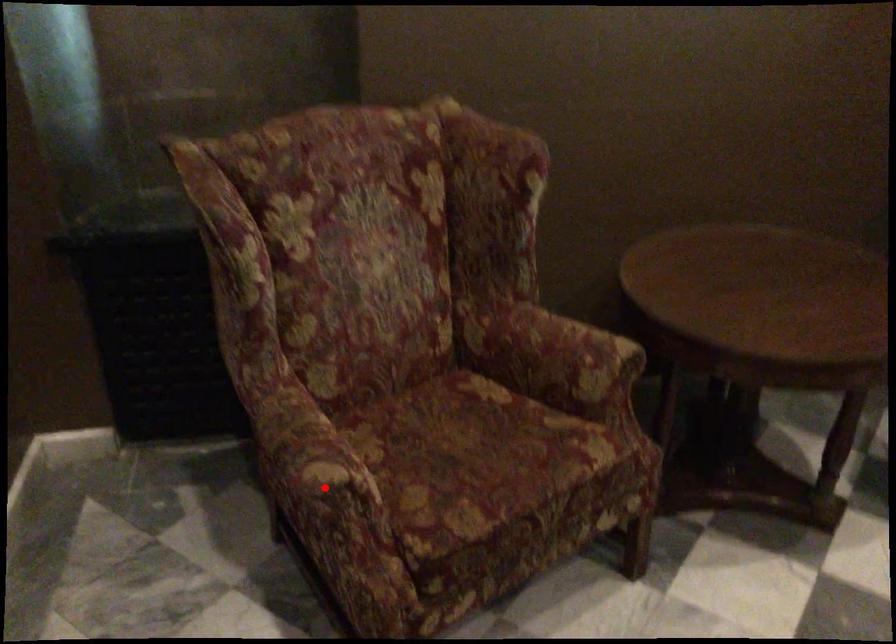
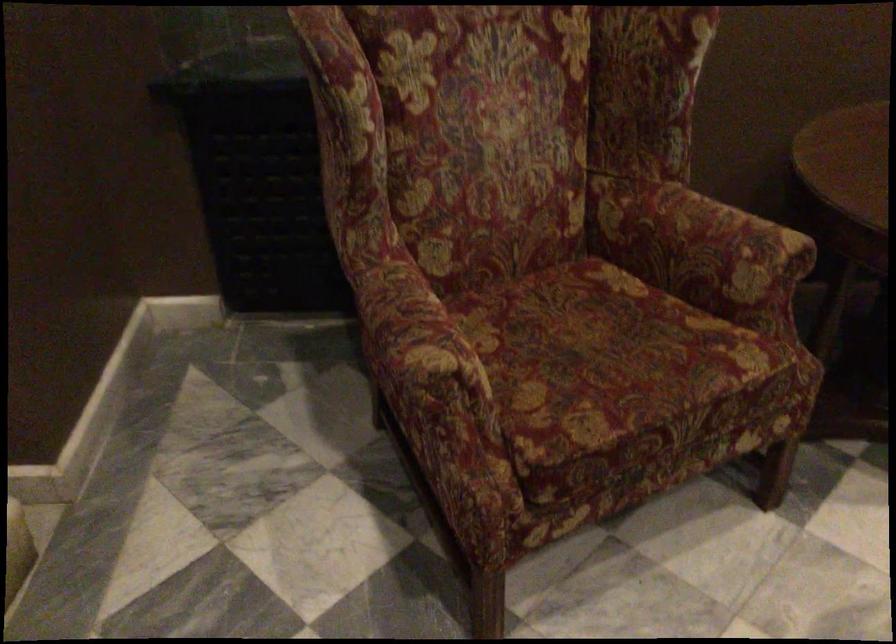
Locate, in the second image, the point that corresponds to the highlighted location in the first image.

(428, 377)